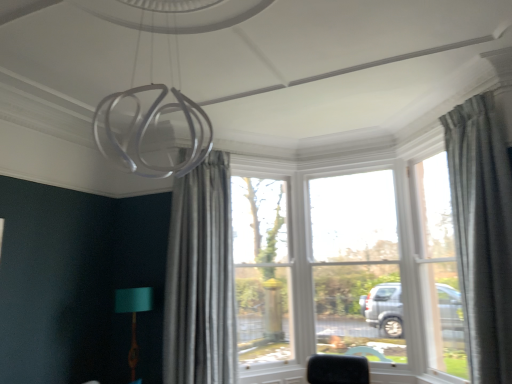
Question: Is textured gray curtain at right, arranged as the 2th curtain when viewed from the left, turned away from teal fabric lampshade at lower left?

Choices:
 (A) yes
 (B) no

Answer: (B)

Question: From a real-world perspective, does textured gray curtain at right, marked as the 1th curtain in a front-to-back arrangement, stand above teal fabric lampshade at lower left?

Choices:
 (A) yes
 (B) no

Answer: (A)

Question: Is textured gray curtain at right, the 2th curtain when ordered from back to front, next to teal fabric lampshade at lower left and touching it?

Choices:
 (A) yes
 (B) no

Answer: (B)

Question: From a real-world perspective, is textured gray curtain at right, marked as the 1th curtain in a front-to-back arrangement, physically below teal fabric lampshade at lower left?

Choices:
 (A) yes
 (B) no

Answer: (B)

Question: Is textured gray curtain at right, arranged as the 2th curtain when viewed from the left, thinner than teal fabric lampshade at lower left?

Choices:
 (A) yes
 (B) no

Answer: (B)

Question: Looking at their shapes, would you say clear glass window at center, which is counted as the 1th window, starting from the left, is wider or thinner than clear glass window at right, the 1th window when ordered from right to left?

Choices:
 (A) wide
 (B) thin

Answer: (A)

Question: From a real-world perspective, is clear glass window at center, which is counted as the 1th window, starting from the left, positioned above or below clear glass window at right, the 2th window positioned from the left?

Choices:
 (A) below
 (B) above

Answer: (A)

Question: Is clear glass window at center, which ranks as the second window in right-to-left order, to the left or to the right of clear glass window at right, the 2th window positioned from the left, in the image?

Choices:
 (A) left
 (B) right

Answer: (A)

Question: Based on their sizes in the image, would you say clear glass window at center, which ranks as the second window in right-to-left order, is bigger or smaller than clear glass window at right, the 2th window positioned from the left?

Choices:
 (A) small
 (B) big

Answer: (B)

Question: In terms of width, does clear glass window at right, the 2th window positioned from the left, look wider or thinner when compared to teal fabric lampshade at lower left?

Choices:
 (A) thin
 (B) wide

Answer: (A)

Question: In terms of size, does clear glass window at right, the 1th window when ordered from right to left, appear bigger or smaller than teal fabric lampshade at lower left?

Choices:
 (A) small
 (B) big

Answer: (B)

Question: From the image's perspective, is clear glass window at right, the 2th window positioned from the left, above or below teal fabric lampshade at lower left?

Choices:
 (A) below
 (B) above

Answer: (B)

Question: Which is correct: clear glass window at right, the 2th window positioned from the left, is inside teal fabric lampshade at lower left, or outside of it?

Choices:
 (A) outside
 (B) inside

Answer: (A)

Question: In the image, is clear glass window at right, the 2th window positioned from the left, positioned in front of or behind textured gray curtain at right, marked as the 1th curtain in a front-to-back arrangement?

Choices:
 (A) front
 (B) behind

Answer: (B)

Question: From the image's perspective, is clear glass window at right, the 1th window when ordered from right to left, positioned above or below textured gray curtain at right, the 2th curtain when ordered from back to front?

Choices:
 (A) above
 (B) below

Answer: (B)